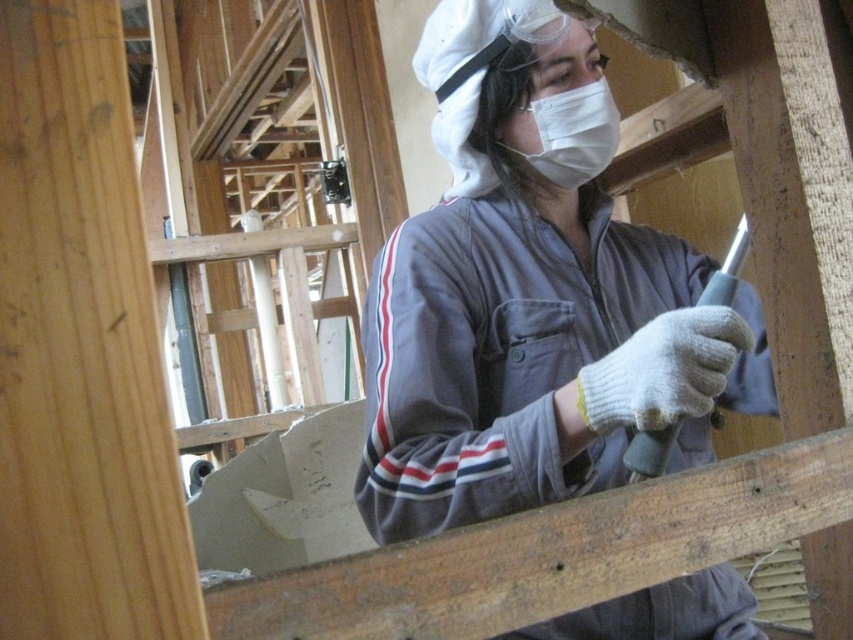
Can you confirm if gray fabric at center is positioned above white fabric mask at center?

Result: No.

Is gray fabric at center thinner than white fabric mask at center?

No.

Where is `gray fabric at center`? gray fabric at center is located at coordinates (527, 308).